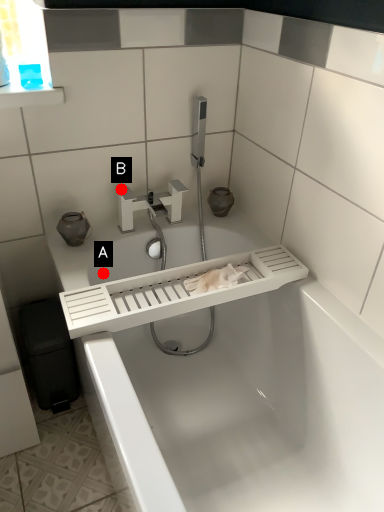
Question: Two points are circled on the image, labeled by A and B beside each circle. Which point appears closest to the camera in this image?

Choices:
 (A) A is closer
 (B) B is closer

Answer: (A)